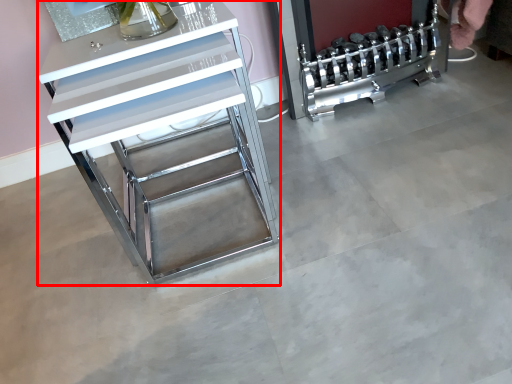
Question: In this image, where is furniture (annotated by the red box) located relative to appliance?

Choices:
 (A) right
 (B) left

Answer: (B)